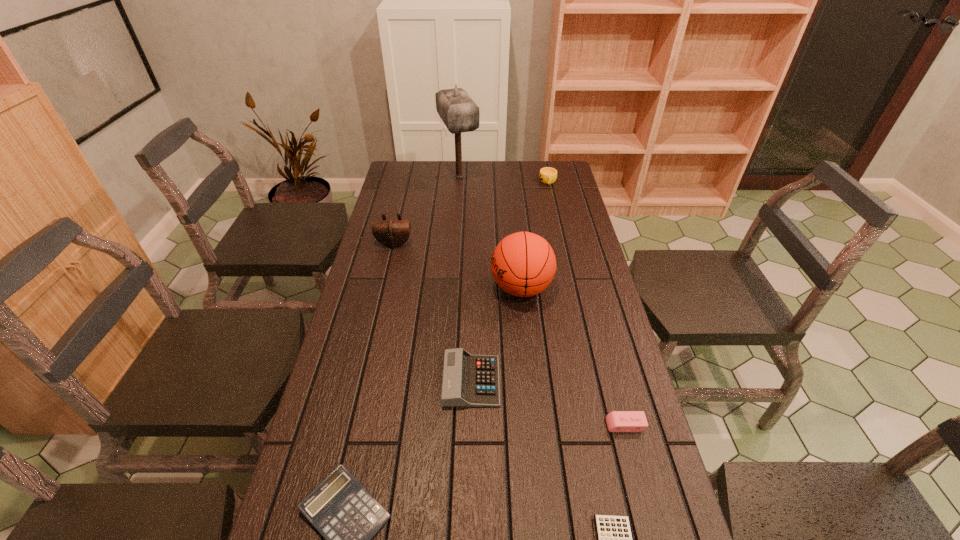
Where is `vacant space that satisfies the following two spatial constraints: 1. with the flap open on the third farthest object; 2. on the right side of the fifth farthest object`? The image size is (960, 540). vacant space that satisfies the following two spatial constraints: 1. with the flap open on the third farthest object; 2. on the right side of the fifth farthest object is located at coordinates (362, 381).